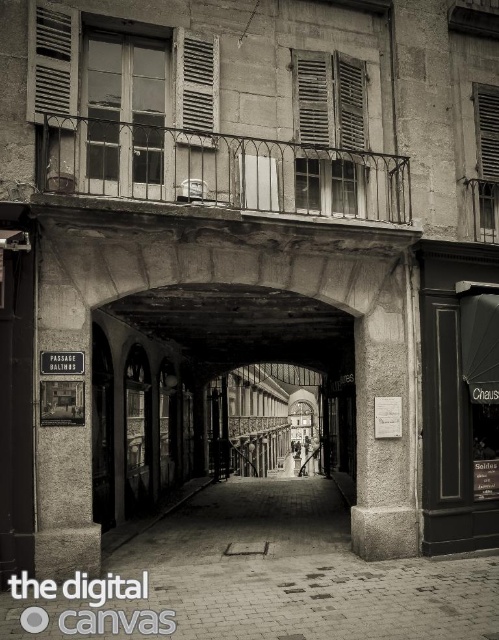
You are standing at the entrance of the passage and want to take a photo of the smooth stone pillar at left and the matte wood shutter at upper right. Which object should you focus on first if you want to capture both in the frame without moving the camera?

You should focus on the smooth stone pillar at left first because it is positioned to the left of the matte wood shutter at upper right, so keeping it in the frame while adjusting the camera angle would allow both objects to be captured.

You are an architect assessing the Passage BALTHUS for restoration. You need to replace the shutters. Which shutter requires a smaller piece of wood for replacement, the matte wood shutter at upper right or the white matte shutter at center?

The matte wood shutter at upper right requires a smaller piece of wood for replacement since its width is less than the white matte shutter at center.

You are a delivery person carrying a 6.5 meter long pipe. You need to navigate through the narrow passage shown in the image. Can you safely transport the pipe horizontally through the space between the smooth stone pillar at left and the matte wood shutter at upper right without tilting it?

The distance between the smooth stone pillar at left and the matte wood shutter at upper right is 7.05 meters. Since the pipe is 6.5 meters long, it can be safely transported horizontally through the space as the available distance is greater than the pipe length.